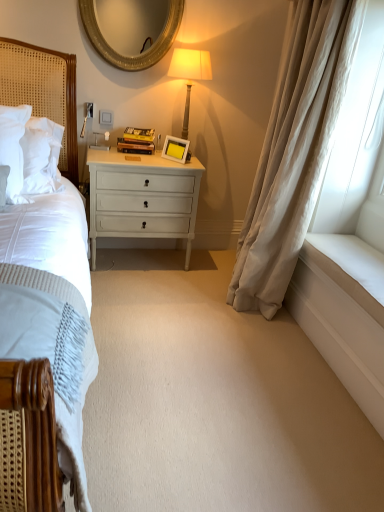
In order to click on white painted wood chest of drawers at center in this screenshot , I will do `click(142, 197)`.

In order to click on matte gold lamp at upper center in this screenshot , I will do `click(189, 74)`.

At what (x,y) coordinates should I click in order to perform the action: click on white matte picture frame at center. Please return your answer as a coordinate pair (x, y). This screenshot has width=384, height=512. Looking at the image, I should click on (175, 149).

Describe the element at coordinates (294, 149) in the screenshot. I see `beige silk curtain at right` at that location.

The width and height of the screenshot is (384, 512). I want to click on beige silk curtain at right, so click(x=294, y=149).

Where is `white painted wood chest of drawers at center`? white painted wood chest of drawers at center is located at coordinates tap(142, 197).

Considering the relative sizes of white painted wood chest of drawers at center and gold textured mirror at upper center in the image provided, is white painted wood chest of drawers at center shorter than gold textured mirror at upper center?

No, white painted wood chest of drawers at center is not shorter than gold textured mirror at upper center.

Which of these two, white painted wood chest of drawers at center or gold textured mirror at upper center, is bigger?

white painted wood chest of drawers at center.

Looking at this image, is white painted wood chest of drawers at center thinner than gold textured mirror at upper center?

No, white painted wood chest of drawers at center is not thinner than gold textured mirror at upper center.

From the image's perspective, is white painted wood chest of drawers at center above gold textured mirror at upper center?

No, from the image's perspective, white painted wood chest of drawers at center is not over gold textured mirror at upper center.

From the image's perspective, would you say white matte picture frame at center is shown under woven wood headboard at left?

No, from the image's perspective, white matte picture frame at center is not beneath woven wood headboard at left.

In the image, is white matte picture frame at center positioned in front of or behind woven wood headboard at left?

In the image, white matte picture frame at center appears behind woven wood headboard at left.

From a real-world perspective, between white matte picture frame at center and woven wood headboard at left, who is vertically lower?

woven wood headboard at left, from a real-world perspective.

Is white matte picture frame at center oriented towards woven wood headboard at left?

No, white matte picture frame at center is not aimed at woven wood headboard at left.

Considering the sizes of white matte picture frame at center and gold textured mirror at upper center in the image, is white matte picture frame at center bigger or smaller than gold textured mirror at upper center?

Considering their sizes, white matte picture frame at center takes up less space than gold textured mirror at upper center.

The width and height of the screenshot is (384, 512). In order to click on picture frame located on the right of gold textured mirror at upper center in this screenshot , I will do `click(175, 149)`.

Are white matte picture frame at center and gold textured mirror at upper center making contact?

No, white matte picture frame at center is not beside gold textured mirror at upper center.

Can we say white matte picture frame at center lies outside gold textured mirror at upper center?

Indeed, white matte picture frame at center is completely outside gold textured mirror at upper center.

From the image's perspective, is matte gold lamp at upper center over white matte picture frame at center?

Indeed, from the image's perspective, matte gold lamp at upper center is shown above white matte picture frame at center.

Can you confirm if matte gold lamp at upper center is positioned to the left of white matte picture frame at center?

No.

Is matte gold lamp at upper center smaller than white matte picture frame at center?

Incorrect, matte gold lamp at upper center is not smaller in size than white matte picture frame at center.

Considering the sizes of objects woven wood headboard at left and white matte picture frame at center in the image provided, who is smaller, woven wood headboard at left or white matte picture frame at center?

white matte picture frame at center is smaller.

Is woven wood headboard at left closer to camera compared to white matte picture frame at center?

Yes, woven wood headboard at left is closer to the viewer.

Is woven wood headboard at left located outside white matte picture frame at center?

Indeed, woven wood headboard at left is completely outside white matte picture frame at center.

What's the angular difference between white painted wood chest of drawers at center and matte gold lamp at upper center's facing directions?

0.694 degrees.

From the image's perspective, does white painted wood chest of drawers at center appear lower than matte gold lamp at upper center?

Yes, from the image's perspective, white painted wood chest of drawers at center is below matte gold lamp at upper center.

From a real-world perspective, is white painted wood chest of drawers at center on top of matte gold lamp at upper center?

No.

Is point (299, 55) behind point (168, 145)?

No, (299, 55) is closer to viewer.

From the image's perspective, which is above, beige silk curtain at right or white matte picture frame at center?

white matte picture frame at center appears higher in the image.

What's the angular difference between beige silk curtain at right and white matte picture frame at center's facing directions?

The facing directions of beige silk curtain at right and white matte picture frame at center are 43.5 degrees apart.

The width and height of the screenshot is (384, 512). I want to click on mirror on the left of white painted wood chest of drawers at center, so click(x=131, y=23).

Locate an element on the screen. This screenshot has width=384, height=512. picture frame behind the woven wood headboard at left is located at coordinates (175, 149).

Looking at the image, which one is located closer to beige silk curtain at right, white painted wood chest of drawers at center or gold textured mirror at upper center?

white painted wood chest of drawers at center lies closer to beige silk curtain at right than the other object.

From the image, which object appears to be nearer to gold textured mirror at upper center, beige silk curtain at right or matte gold lamp at upper center?

matte gold lamp at upper center.

Looking at the image, which one is located closer to gold textured mirror at upper center, white matte picture frame at center or woven wood headboard at left?

woven wood headboard at left.

Based on their spatial positions, is gold textured mirror at upper center or matte gold lamp at upper center further from beige silk curtain at right?

gold textured mirror at upper center is further to beige silk curtain at right.

Estimate the real-world distances between objects in this image. Which object is closer to beige silk curtain at right, white matte picture frame at center or woven wood headboard at left?

The object closer to beige silk curtain at right is white matte picture frame at center.

When comparing their distances from woven wood headboard at left, does white painted wood chest of drawers at center or gold textured mirror at upper center seem closer?

The object closer to woven wood headboard at left is white painted wood chest of drawers at center.

Which object lies nearer to the anchor point gold textured mirror at upper center, white painted wood chest of drawers at center or woven wood headboard at left?

woven wood headboard at left is positioned closer to the anchor gold textured mirror at upper center.

In the scene shown: When comparing their distances from gold textured mirror at upper center, does beige silk curtain at right or white matte picture frame at center seem further?

beige silk curtain at right is further to gold textured mirror at upper center.

The height and width of the screenshot is (512, 384). In order to click on bedside lamp between beige silk curtain at right and white painted wood chest of drawers at center in the front-back direction in this screenshot , I will do `click(189, 74)`.

Find the location of a particular element. chest of drawers between woven wood headboard at left and beige silk curtain at right is located at coordinates (142, 197).

I want to click on mirror located between woven wood headboard at left and beige silk curtain at right in the left-right direction, so click(131, 23).

What are the coordinates of `picture frame between gold textured mirror at upper center and woven wood headboard at left from top to bottom` in the screenshot? It's located at (175, 149).